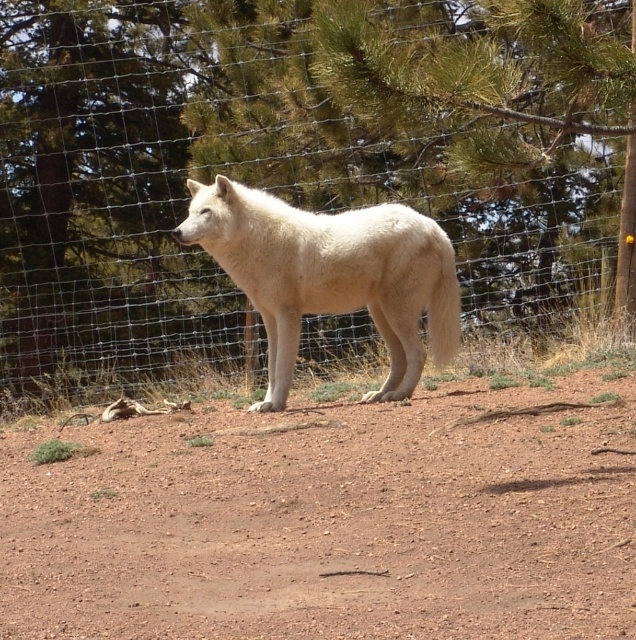
Question: Which of these objects is positioned closest to the brown dirt track at center?

Choices:
 (A) wire mesh fence at center
 (B) white fur wolf at center

Answer: (B)

Question: Is wire mesh fence at center below white fur wolf at center?

Choices:
 (A) no
 (B) yes

Answer: (A)

Question: Among these objects, which one is nearest to the camera?

Choices:
 (A) brown dirt track at center
 (B) white fur wolf at center

Answer: (A)

Question: Which of the following is the closest to the observer?

Choices:
 (A) (39, 314)
 (B) (453, 320)

Answer: (B)

Question: In this image, where is wire mesh fence at center located relative to white fur wolf at center?

Choices:
 (A) left
 (B) right

Answer: (A)

Question: Is wire mesh fence at center smaller than brown dirt track at center?

Choices:
 (A) yes
 (B) no

Answer: (A)